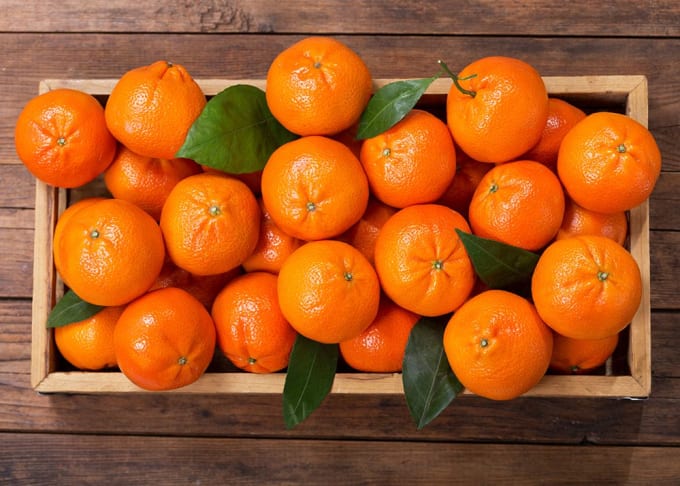
Identify the location of wood board. This screenshot has width=680, height=486. (78, 23), (65, 59), (18, 269), (20, 336), (122, 471).